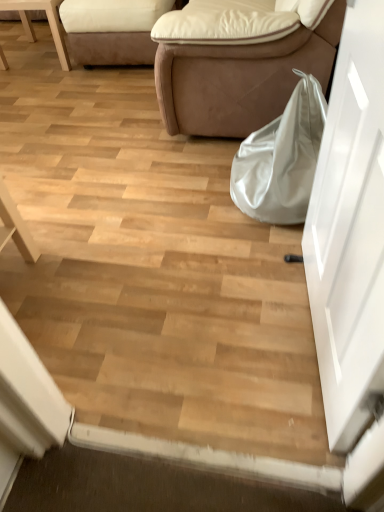
Find the location of a particular element. This screenshot has width=384, height=512. free space that is to the left of satin white bag at lower right is located at coordinates (185, 197).